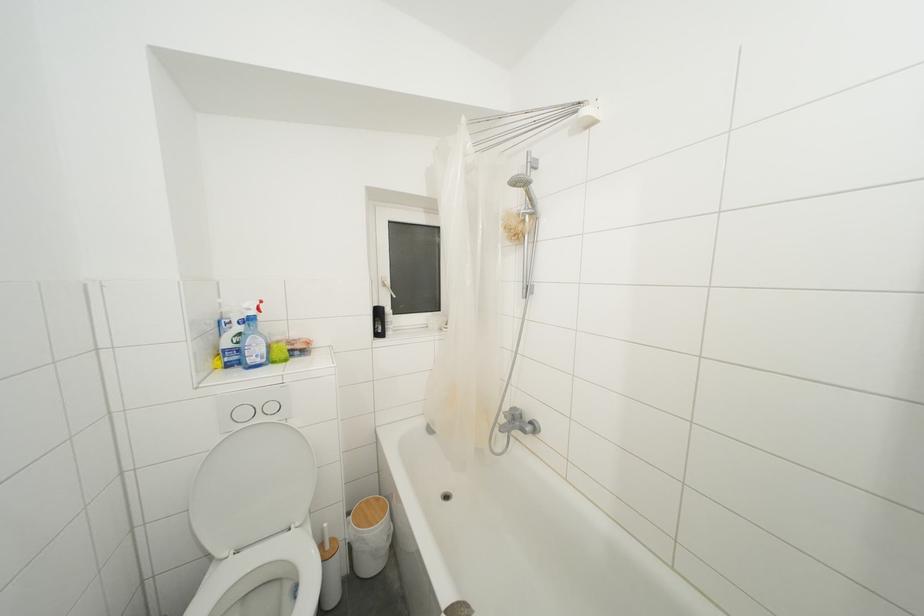
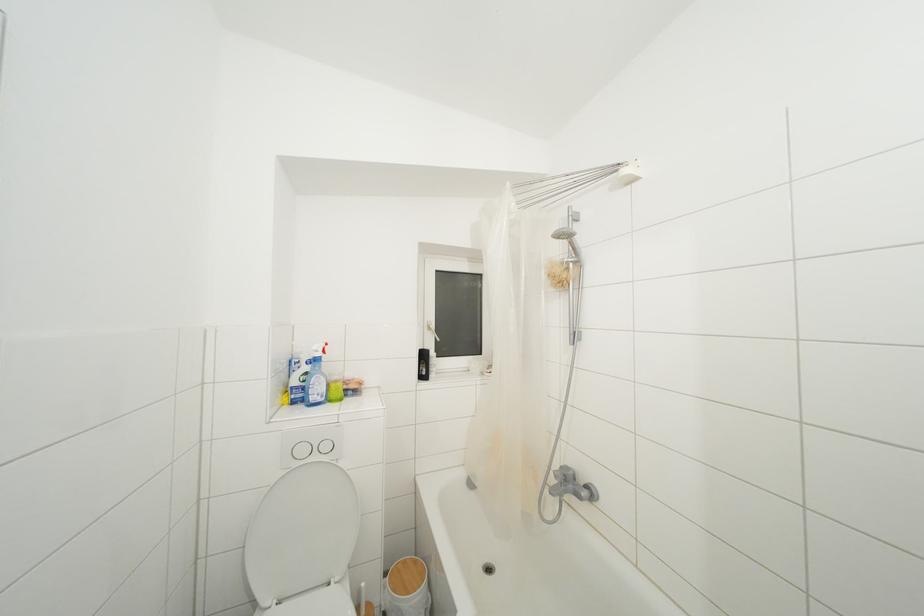
In the second image, find the point that corresponds to [371,506] in the first image.

(408, 567)